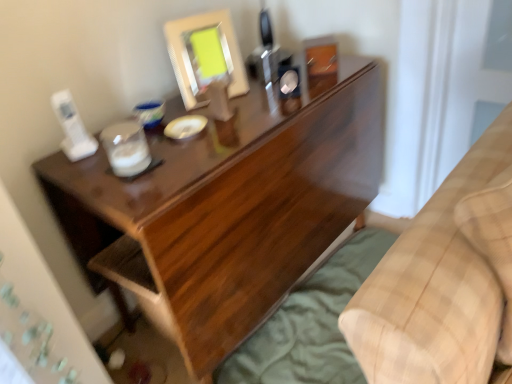
Question: In terms of height, does beige plaid blanket at lower right look taller or shorter compared to matte white frame at upper center?

Choices:
 (A) short
 (B) tall

Answer: (B)

Question: Looking at their shapes, would you say beige plaid blanket at lower right is wider or thinner than matte white frame at upper center?

Choices:
 (A) wide
 (B) thin

Answer: (A)

Question: Which of these objects is positioned closest to the green fabric sheet at lower right?

Choices:
 (A) dark wood desk at center
 (B) matte white frame at upper center
 (C) beige plaid blanket at lower right

Answer: (A)

Question: Based on their relative distances, which object is farther from the beige plaid blanket at lower right?

Choices:
 (A) dark wood desk at center
 (B) matte white frame at upper center
 (C) green fabric sheet at lower right

Answer: (B)